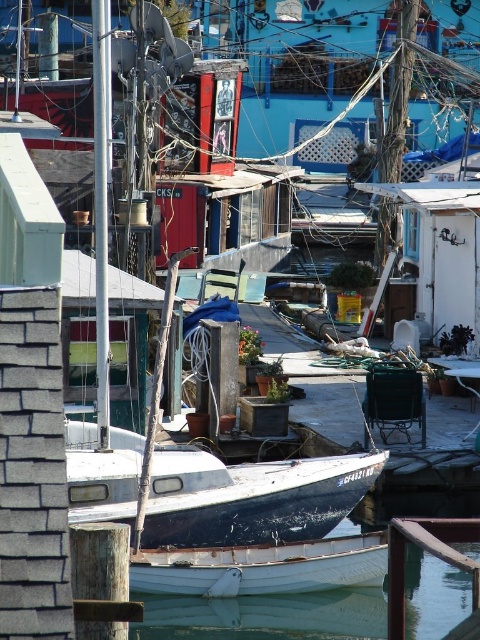
Who is positioned more to the left, white smooth water at lower center or white matte boat at lower center?

From the viewer's perspective, white matte boat at lower center appears more on the left side.

Based on the photo, measure the distance from white smooth water at lower center to white matte boat at lower center.

white smooth water at lower center and white matte boat at lower center are 16.76 inches apart.

Describe the element at coordinates (266, 616) in the screenshot. I see `white smooth water at lower center` at that location.

What are the coordinates of `white smooth water at lower center` in the screenshot? It's located at (266, 616).